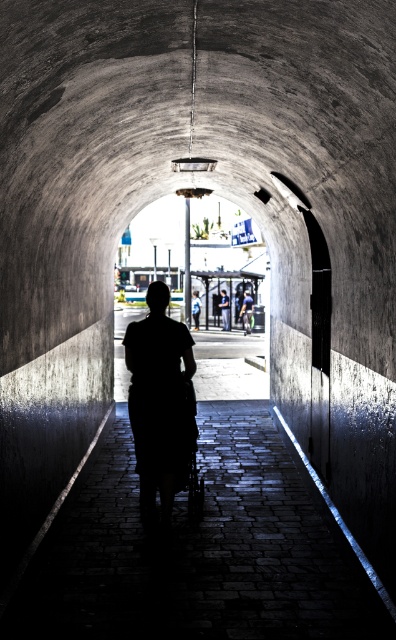
Question: Which of these objects is positioned farthest from the light brown leather jacket at center?

Choices:
 (A) green fabric shirt at center
 (B) silhouette dress at center

Answer: (B)

Question: Which object appears closest to the camera in this image?

Choices:
 (A) light brown leather jacket at center
 (B) green fabric shirt at center

Answer: (B)

Question: Can you confirm if green fabric shirt at center is positioned to the left of light brown leather jacket at center?

Choices:
 (A) no
 (B) yes

Answer: (A)

Question: Is silhouette dress at center closer to the viewer compared to light brown leather jacket at center?

Choices:
 (A) no
 (B) yes

Answer: (B)

Question: Is green fabric shirt at center wider than light brown leather jacket at center?

Choices:
 (A) yes
 (B) no

Answer: (A)

Question: Which of these objects is positioned farthest from the green fabric shirt at center?

Choices:
 (A) silhouette dress at center
 (B) light brown leather jacket at center

Answer: (A)